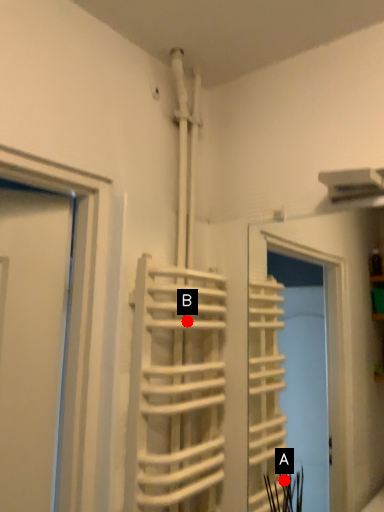
Question: Two points are circled on the image, labeled by A and B beside each circle. Which point appears farthest from the camera in this image?

Choices:
 (A) A is further
 (B) B is further

Answer: (B)